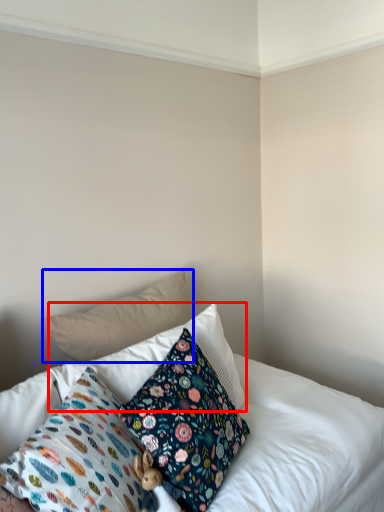
Question: Among these objects, which one is nearest to the camera, pillow (highlighted by a red box) or pillow (highlighted by a blue box)?

Choices:
 (A) pillow
 (B) pillow

Answer: (A)